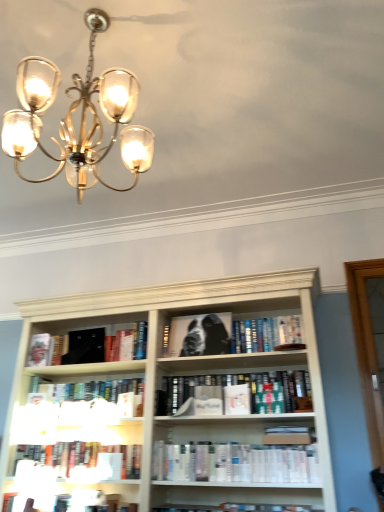
Identify the location of vacant space underneath hardcover books at lower center, the third book in the bottom-to-top sequence (from a real-world perspective). The width and height of the screenshot is (384, 512). (81, 489).